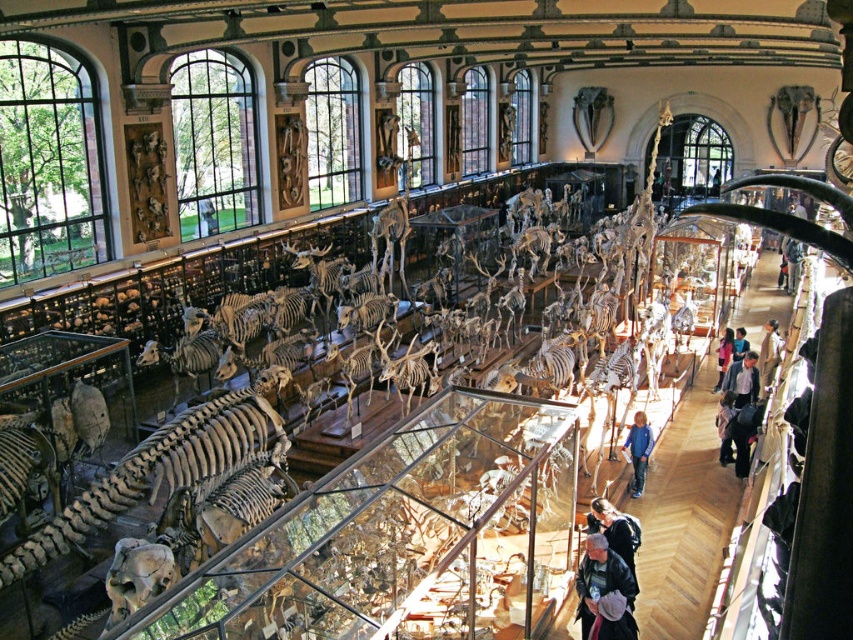
Question: Is dark gray jacket at lower center wider than light brown leather jacket at center?

Choices:
 (A) yes
 (B) no

Answer: (B)

Question: Does dark gray jacket at lower center appear on the left side of light brown leather jacket at center?

Choices:
 (A) no
 (B) yes

Answer: (B)

Question: Estimate the real-world distances between objects in this image. Which object is farther from the light brown leather jacket at center?

Choices:
 (A) dark gray jacket at lower center
 (B) light brown leather jacket at right

Answer: (A)

Question: Can you confirm if dark gray jacket at lower center is positioned to the right of light brown leather jacket at right?

Choices:
 (A) no
 (B) yes

Answer: (A)

Question: Which point is farther from the camera taking this photo?

Choices:
 (A) (750, 396)
 (B) (770, 384)

Answer: (B)

Question: Estimate the real-world distances between objects in this image. Which object is farther from the light brown leather jacket at right?

Choices:
 (A) blue denim jeans at center
 (B) light blue denim jacket at center
 (C) dark gray jacket at lower center
 (D) light brown leather jacket at center

Answer: (C)